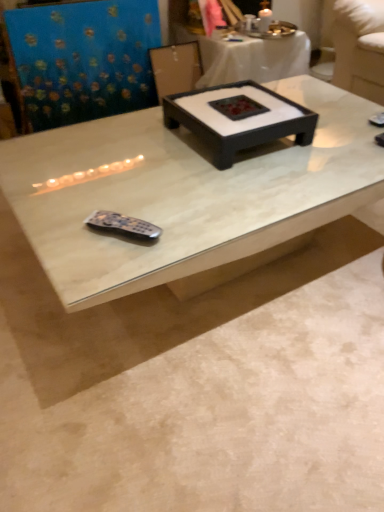
Question: Which direction should I rotate to look at white marble coffee table at center, which appears as the first coffee table when viewed from the left?

Choices:
 (A) left
 (B) right

Answer: (B)

Question: Is black matte tray at center, which ranks as the 2th coffee table in left-to-right order, with white marble coffee table at center, which is the 2th coffee table from right to left?

Choices:
 (A) yes
 (B) no

Answer: (B)

Question: From a real-world perspective, is black matte tray at center, which ranks as the 2th coffee table in left-to-right order, on top of white marble coffee table at center, which appears as the first coffee table when viewed from the left?

Choices:
 (A) yes
 (B) no

Answer: (A)

Question: Does black matte tray at center, the first coffee table viewed from the right, have a lesser width compared to white marble coffee table at center, which appears as the first coffee table when viewed from the left?

Choices:
 (A) no
 (B) yes

Answer: (B)

Question: From the image's perspective, would you say black matte tray at center, the first coffee table viewed from the right, is shown under white marble coffee table at center, which is the 2th coffee table from right to left?

Choices:
 (A) yes
 (B) no

Answer: (B)

Question: Considering the relative sizes of black matte tray at center, which ranks as the 2th coffee table in left-to-right order, and white marble coffee table at center, which is the 2th coffee table from right to left, in the image provided, is black matte tray at center, which ranks as the 2th coffee table in left-to-right order, smaller than white marble coffee table at center, which is the 2th coffee table from right to left,?

Choices:
 (A) no
 (B) yes

Answer: (B)

Question: Is black matte tray at center, which ranks as the 2th coffee table in left-to-right order, to the left of white marble coffee table at center, which is the 2th coffee table from right to left, from the viewer's perspective?

Choices:
 (A) no
 (B) yes

Answer: (A)

Question: Is white marble coffee table at center, which appears as the first coffee table when viewed from the left, to the left of black matte tray at center, the first coffee table viewed from the right, from the viewer's perspective?

Choices:
 (A) no
 (B) yes

Answer: (B)

Question: From the image's perspective, is white marble coffee table at center, which is the 2th coffee table from right to left, on black matte tray at center, which ranks as the 2th coffee table in left-to-right order?

Choices:
 (A) no
 (B) yes

Answer: (A)

Question: Is white marble coffee table at center, which appears as the first coffee table when viewed from the left, facing away from black matte tray at center, which ranks as the 2th coffee table in left-to-right order?

Choices:
 (A) yes
 (B) no

Answer: (B)

Question: Considering the relative positions of white marble coffee table at center, which appears as the first coffee table when viewed from the left, and black matte tray at center, the first coffee table viewed from the right, in the image provided, is white marble coffee table at center, which appears as the first coffee table when viewed from the left, to the right of black matte tray at center, the first coffee table viewed from the right, from the viewer's perspective?

Choices:
 (A) yes
 (B) no

Answer: (B)

Question: Considering the relative sizes of white marble coffee table at center, which is the 2th coffee table from right to left, and black matte tray at center, which ranks as the 2th coffee table in left-to-right order, in the image provided, is white marble coffee table at center, which is the 2th coffee table from right to left, smaller than black matte tray at center, which ranks as the 2th coffee table in left-to-right order,?

Choices:
 (A) yes
 (B) no

Answer: (B)

Question: Looking at their shapes, would you say white marble coffee table at center, which appears as the first coffee table when viewed from the left, is wider or thinner than black matte tray at center, the first coffee table viewed from the right?

Choices:
 (A) wide
 (B) thin

Answer: (A)